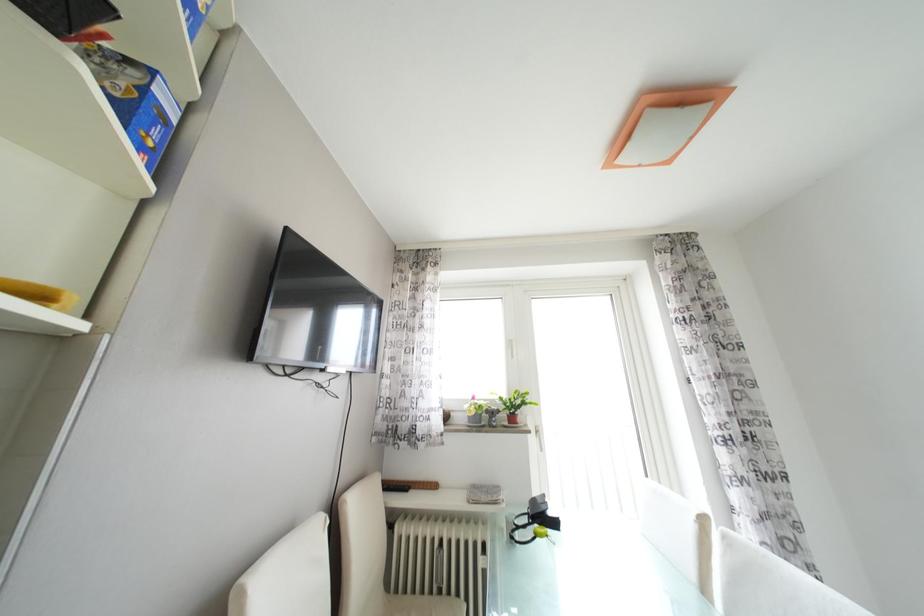
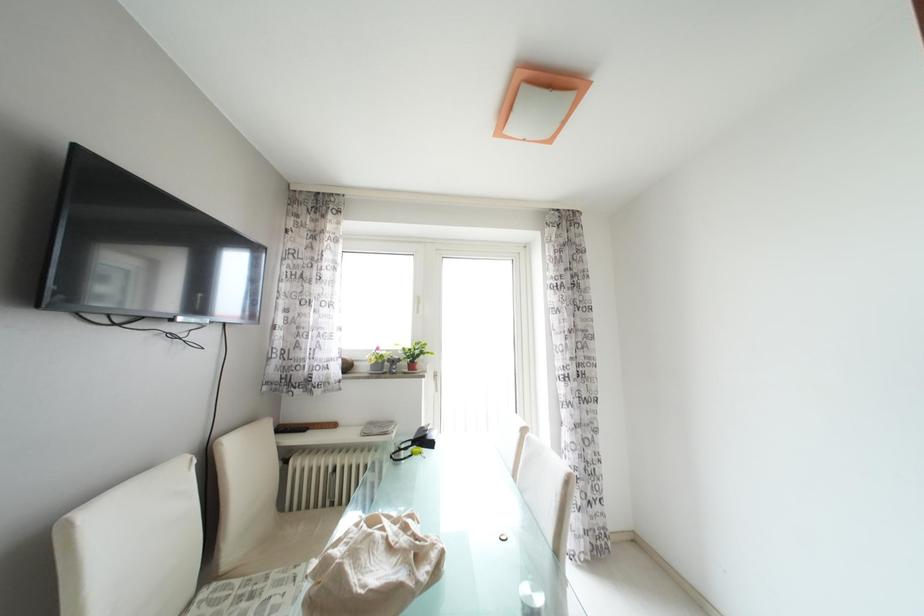
Question: Based on the continuous images, in which direction is the camera rotating? Reply with the corresponding letter.

Choices:
 (A) Left
 (B) Right
 (C) Up
 (D) Down

Answer: (B)